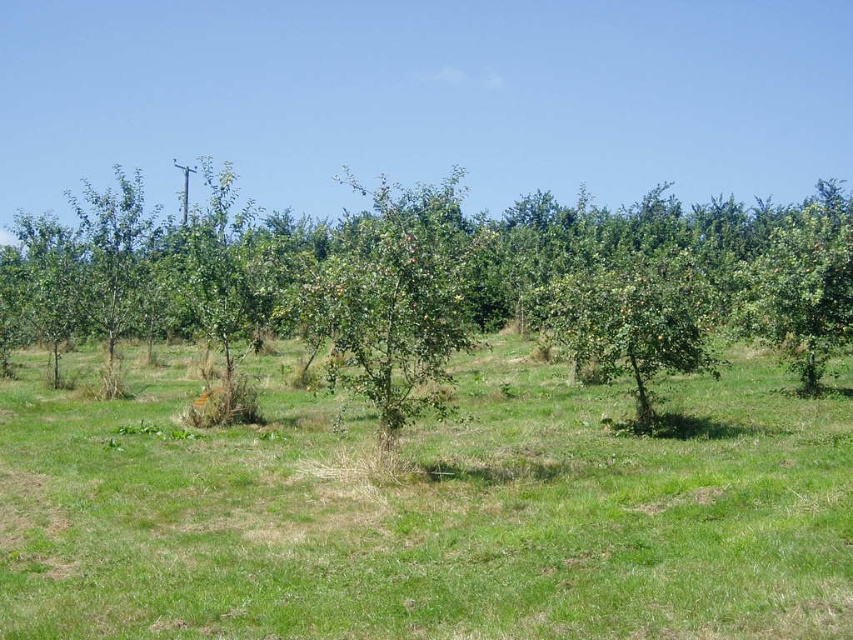
Question: Does green grass at center appear over green leafy tree at center?

Choices:
 (A) no
 (B) yes

Answer: (A)

Question: Which point appears farthest from the camera in this image?

Choices:
 (A) (463, 595)
 (B) (579, 266)

Answer: (B)

Question: Is green grass at center in front of green leafy tree at center?

Choices:
 (A) yes
 (B) no

Answer: (A)

Question: Which point is closer to the camera taking this photo?

Choices:
 (A) (738, 544)
 (B) (619, 257)

Answer: (A)

Question: Which point is closer to the camera taking this photo?

Choices:
 (A) (520, 541)
 (B) (300, 269)

Answer: (A)

Question: Does green grass at center have a smaller size compared to green leafy tree at center?

Choices:
 (A) yes
 (B) no

Answer: (A)